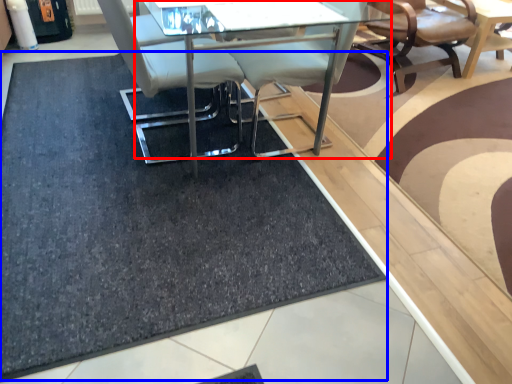
Question: Which point is further to the camera, table (highlighted by a red box) or doormat (highlighted by a blue box)?

Choices:
 (A) table
 (B) doormat

Answer: (A)